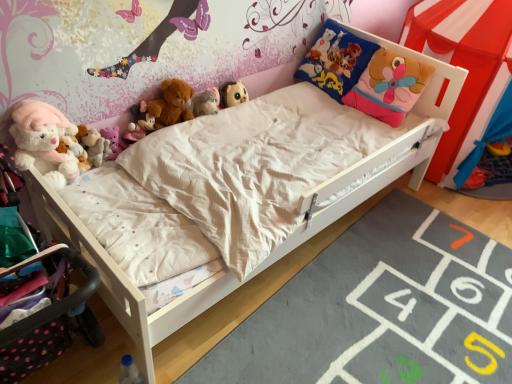
Locate an element on the screen. The image size is (512, 384). vacant space to the right of blue plastic bottle at lower left, the first toy ordered from the bottom is located at coordinates (194, 369).